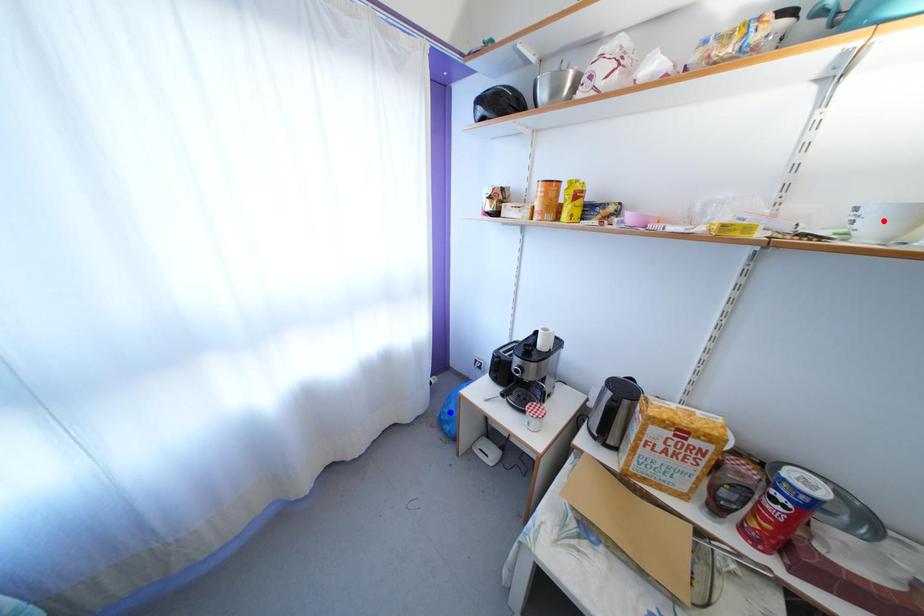
Question: In the image, two points are highlighted. Which point is nearer to the camera? Reply with the corresponding letter.

Choices:
 (A) blue point
 (B) red point

Answer: (B)